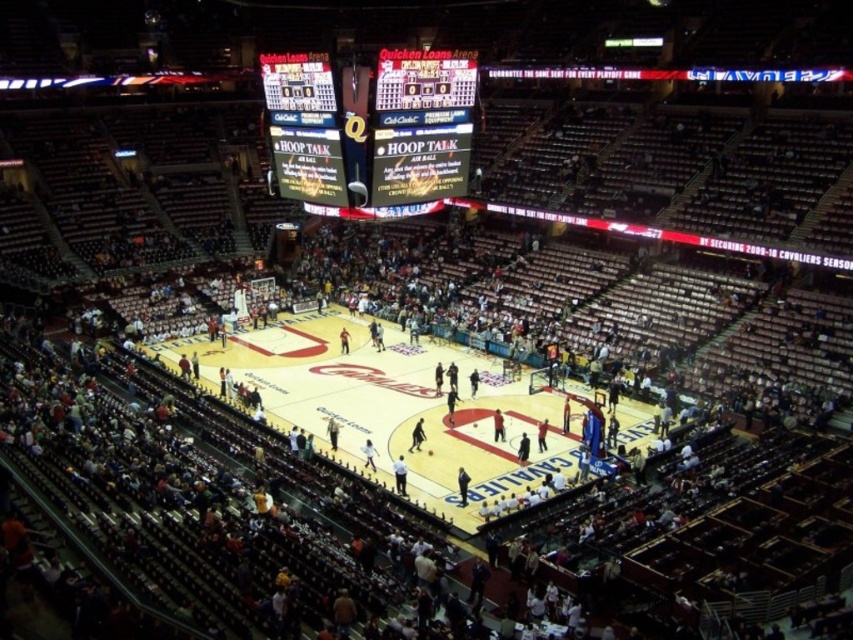
Question: Among these points, which one is nearest to the camera?

Choices:
 (A) (421, 54)
 (B) (345, 96)

Answer: (B)

Question: Does black glossy scoreboard at upper center appear on the left side of matte black scoreboard at upper center?

Choices:
 (A) no
 (B) yes

Answer: (B)

Question: Among these objects, which one is farthest from the camera?

Choices:
 (A) matte black scoreboard at upper center
 (B) black glossy scoreboard at upper center

Answer: (B)

Question: Does black glossy scoreboard at upper center appear on the left side of matte black scoreboard at upper center?

Choices:
 (A) no
 (B) yes

Answer: (B)

Question: From the image, what is the correct spatial relationship of black glossy scoreboard at upper center in relation to matte black scoreboard at upper center?

Choices:
 (A) left
 (B) right

Answer: (A)

Question: Which point is closer to the camera?

Choices:
 (A) (x=440, y=65)
 (B) (x=294, y=189)

Answer: (A)